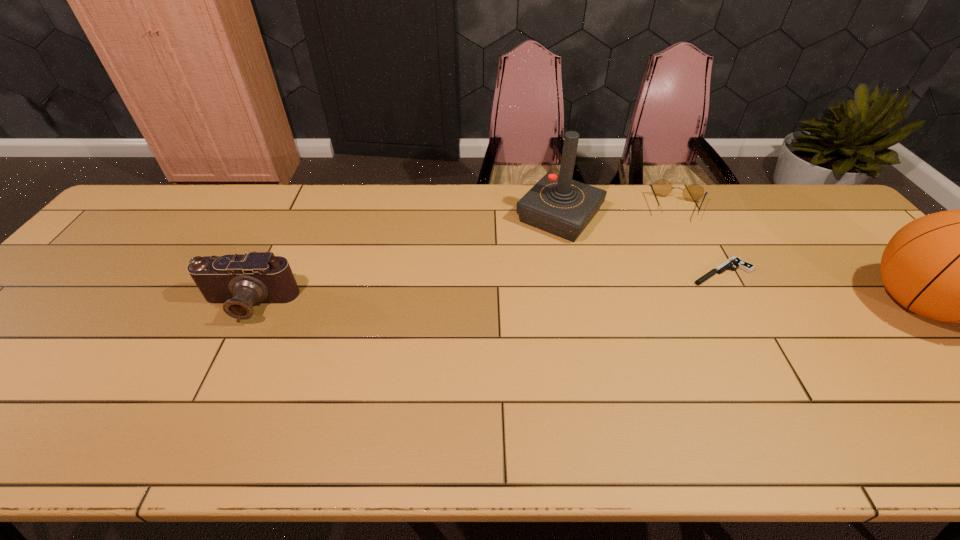
Locate an element on the screen. This screenshot has height=540, width=960. blank space located on the rectangular base of the joystick is located at coordinates (530, 250).

The width and height of the screenshot is (960, 540). I want to click on free space located 0.400m on the rectangular base of the joystick, so click(460, 330).

This screenshot has height=540, width=960. I want to click on free space located on the front-facing side of the fourth tallest object, so click(681, 317).

Locate an element on the screen. vacant space situated on the front-facing side of the fourth tallest object is located at coordinates click(x=681, y=292).

Identify the location of vacant space located 0.390m on the front-facing side of the fourth tallest object. (681, 317).

Locate an element on the screen. Image resolution: width=960 pixels, height=540 pixels. joystick situated at the far edge is located at coordinates (556, 204).

The height and width of the screenshot is (540, 960). In order to click on spectacles located in the far edge section of the desktop in this screenshot , I will do `click(662, 187)`.

You are a GUI agent. You are given a task and a screenshot of the screen. Output one action in this format:
    pyautogui.click(x=<x>, y=<y>)
    Task: Click on the vacant space at the far edge of the desktop
    The height and width of the screenshot is (540, 960).
    Given the screenshot: What is the action you would take?
    pyautogui.click(x=252, y=190)

Locate an element on the screen. The image size is (960, 540). vacant space at the near edge is located at coordinates (488, 398).

This screenshot has width=960, height=540. Find the location of `vacant region at the left edge of the desktop`. vacant region at the left edge of the desktop is located at coordinates (126, 246).